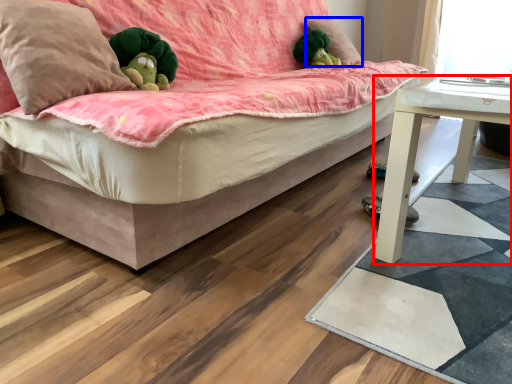
Question: Which object is further to the camera taking this photo, table (highlighted by a red box) or pillow (highlighted by a blue box)?

Choices:
 (A) table
 (B) pillow

Answer: (B)